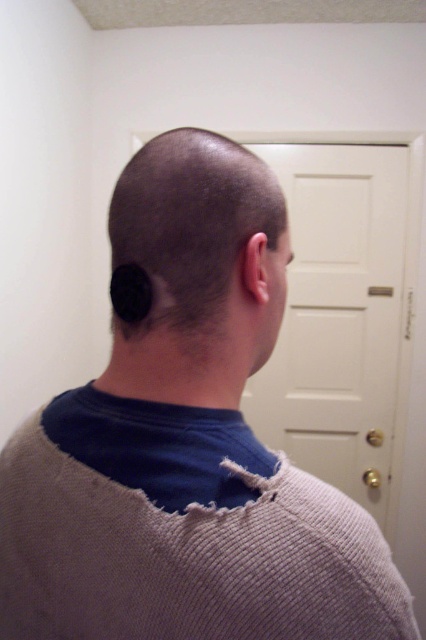
Can you confirm if black matte hair at center is positioned above black matte hair at back?

Yes, black matte hair at center is above black matte hair at back.

Does point (131, 275) lie behind point (143, 304)?

Yes, point (131, 275) is farther from viewer.

Between point (244, 196) and point (141, 317), which one is positioned in front?

Point (141, 317) is in front.

Find the location of a particular element. This screenshot has height=640, width=426. black matte hair at center is located at coordinates (186, 230).

Can you confirm if white matte door at center is positioned above black matte hair at back?

Actually, white matte door at center is below black matte hair at back.

Does point (333, 150) come behind point (123, 268)?

That is True.

Find the location of a particular element. The height and width of the screenshot is (640, 426). white matte door at center is located at coordinates (339, 317).

Can you confirm if woolen sweater at back is bigger than black matte hair at center?

Indeed, woolen sweater at back has a larger size compared to black matte hair at center.

Which is in front, point (290, 552) or point (210, 301)?

Point (290, 552)

I want to click on woolen sweater at back, so click(181, 532).